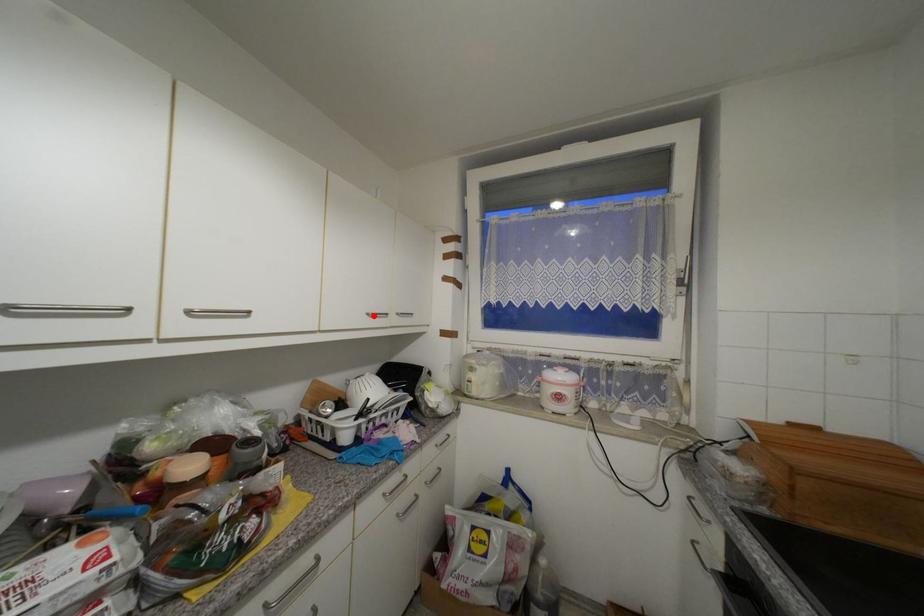
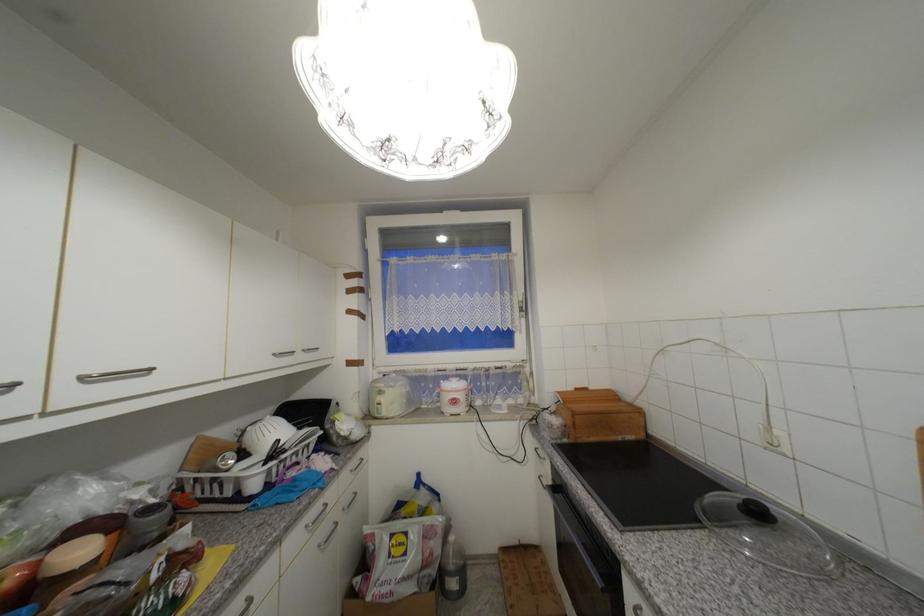
In the second image, find the point that corresponds to the highlighted location in the first image.

(281, 355)